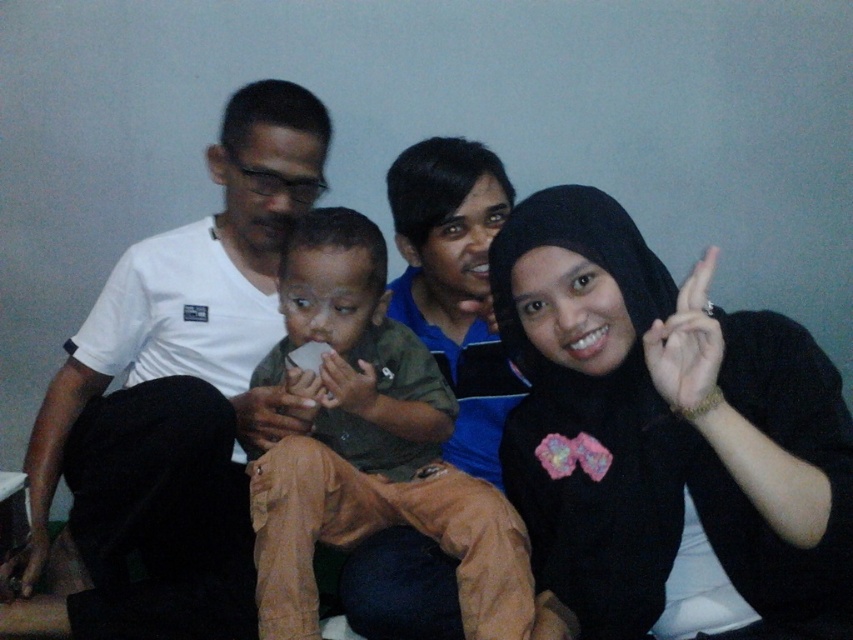
You are trying to find the black matte hijab at right in the image. Based on the scene description, where would you look relative to the brown cotton shirt at center?

The black matte hijab at right is located below the brown cotton shirt at center, so you should look downward from the brown cotton shirt at center to find it.